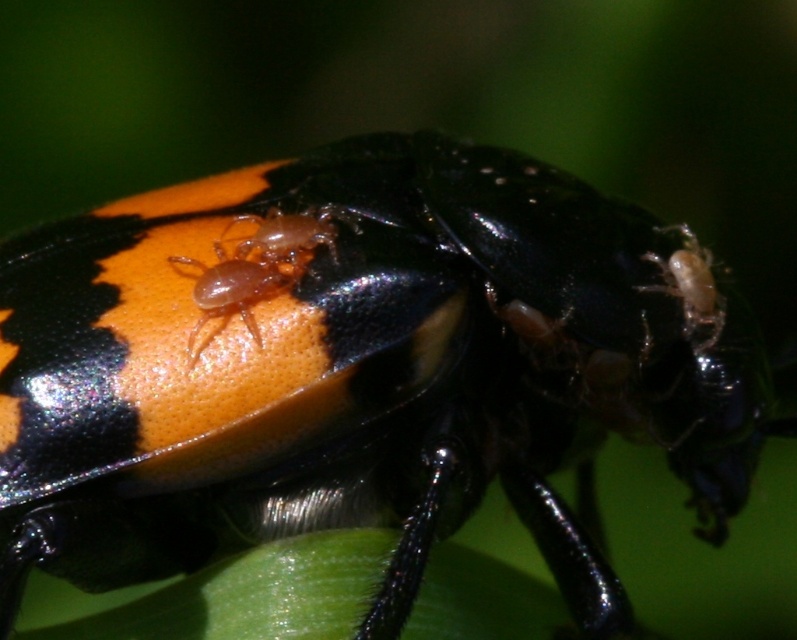
You are a photographer trying to capture a detailed image of the translucent orange spider at center and the translucent beige spider at upper right. Which spider will appear larger in your photo?

The translucent orange spider at center will appear larger in the photo because it is closer to the viewer than the translucent beige spider at upper right.

You are a biologist observing the beetle and want to collect both the translucent orange spider at center and the translucent beige spider at upper right for study. Given that your collection jar has a diameter of 15 inches, will both spiders fit side by side inside the jar without overlapping?

The distance between the translucent orange spider at center and the translucent beige spider at upper right is 14.66 inches. Since the jar has a diameter of 15 inches, the spiders can fit side by side as the distance between them is less than the jar diameter.

You are an entomologist observing the beetle. You notice two spiders on it. Which spider, the translucent orange spider at center or the translucent beige spider at upper right, has a greater height?

The translucent orange spider at center is taller than the translucent beige spider at upper right.